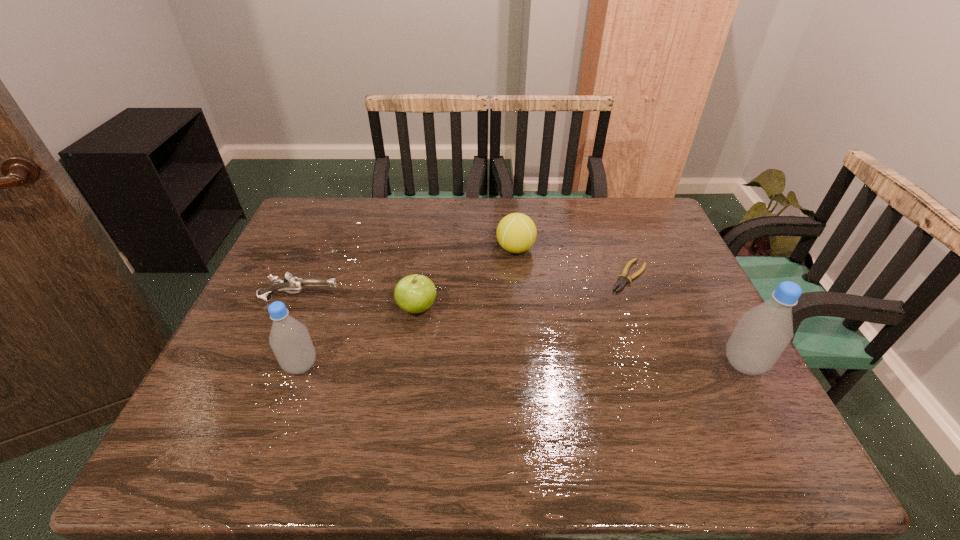
Where is `the left bottle`? the left bottle is located at coordinates (289, 339).

Where is `the second tallest object`? the second tallest object is located at coordinates (289, 339).

Where is `the rightmost object`? the rightmost object is located at coordinates (763, 332).

Where is `the taller bottle`? the taller bottle is located at coordinates (x=763, y=332).

In order to click on tennis ball in this screenshot , I will do `click(516, 233)`.

Locate an element on the screen. Image resolution: width=960 pixels, height=540 pixels. apple is located at coordinates (416, 293).

Where is `the shortest object`? the shortest object is located at coordinates (621, 283).

At what (x,y) coordinates should I click in order to perform the action: click on the fifth object from left to right. Please return your answer as a coordinate pair (x, y). Looking at the image, I should click on (621, 283).

Locate an element on the screen. Image resolution: width=960 pixels, height=540 pixels. the fifth tallest object is located at coordinates (290, 283).

Locate an element on the screen. free location located on the back of the second tallest object is located at coordinates (316, 323).